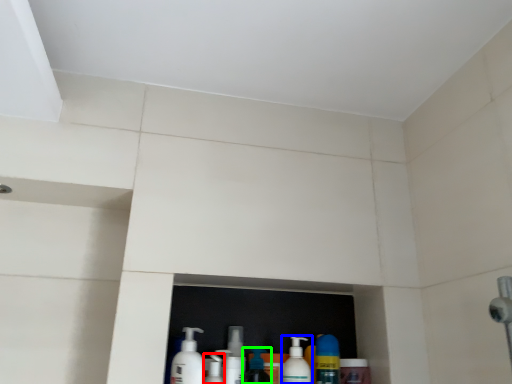
Question: Based on their relative distances, which object is nearer to cleaning product (highlighted by a red box)? Choose from cleaning product (highlighted by a blue box) and cleaning product (highlighted by a green box).

Choices:
 (A) cleaning product
 (B) cleaning product

Answer: (B)